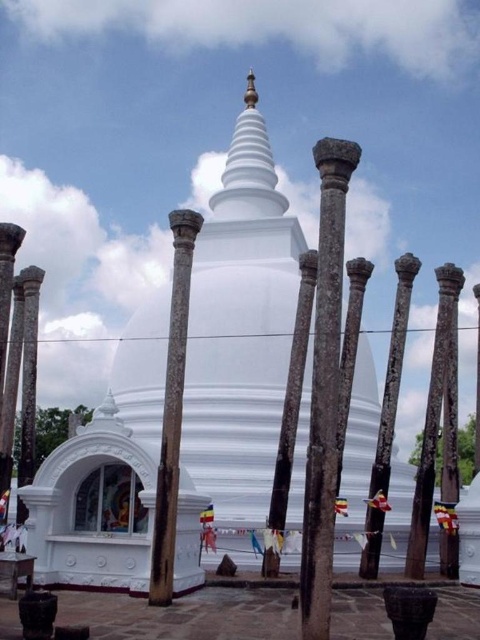
You are standing at the entrance of the stupa complex and want to locate the rusty metal pole at center. According to the coordinates provided, where should you look relative to the stupa?

The rusty metal pole at center is located at coordinates point (x=172, y=408), which means it is positioned to the right and slightly below the center of the stupa complex.

You are an architect assessing the structural integrity of the brown stone column at center and the smooth stone column at center. Which column has a narrower width?

The brown stone column at center has a narrower width than the smooth stone column at center according to the description.